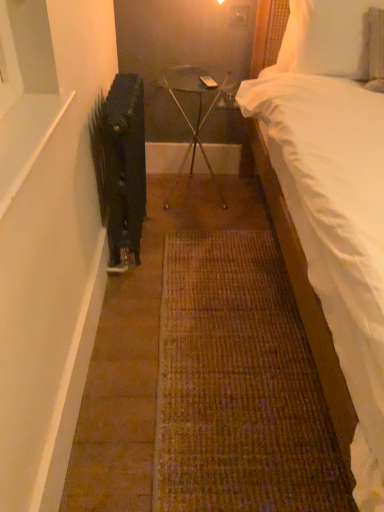
Question: Is metallic glass table at center facing away from white soft pillow at upper right?

Choices:
 (A) no
 (B) yes

Answer: (A)

Question: From the image's perspective, does metallic glass table at center appear higher than white soft pillow at upper right?

Choices:
 (A) yes
 (B) no

Answer: (B)

Question: Would you say white soft pillow at upper right is part of metallic glass table at center's contents?

Choices:
 (A) no
 (B) yes

Answer: (A)

Question: From the image's perspective, would you say metallic glass table at center is shown under white soft pillow at upper right?

Choices:
 (A) yes
 (B) no

Answer: (A)

Question: From a real-world perspective, is metallic glass table at center physically above white soft pillow at upper right?

Choices:
 (A) yes
 (B) no

Answer: (B)

Question: From the image's perspective, is white soft bed at right positioned above or below metallic glass table at center?

Choices:
 (A) below
 (B) above

Answer: (A)

Question: Considering their positions, is white soft bed at right located in front of or behind metallic glass table at center?

Choices:
 (A) behind
 (B) front

Answer: (B)

Question: Based on their sizes in the image, would you say white soft bed at right is bigger or smaller than metallic glass table at center?

Choices:
 (A) small
 (B) big

Answer: (B)

Question: Is white soft bed at right inside or outside of metallic glass table at center?

Choices:
 (A) outside
 (B) inside

Answer: (A)

Question: In the image, is black matte radiator at left on the left side or the right side of white soft bed at right?

Choices:
 (A) right
 (B) left

Answer: (B)

Question: From a real-world perspective, is black matte radiator at left physically located above or below white soft bed at right?

Choices:
 (A) below
 (B) above

Answer: (A)

Question: Is black matte radiator at left wider or thinner than white soft bed at right?

Choices:
 (A) thin
 (B) wide

Answer: (A)

Question: Is black matte radiator at left taller or shorter than white soft bed at right?

Choices:
 (A) short
 (B) tall

Answer: (A)

Question: Is white soft pillow at upper right inside the boundaries of black matte radiator at left, or outside?

Choices:
 (A) inside
 (B) outside

Answer: (B)

Question: Is white soft pillow at upper right taller or shorter than black matte radiator at left?

Choices:
 (A) tall
 (B) short

Answer: (B)